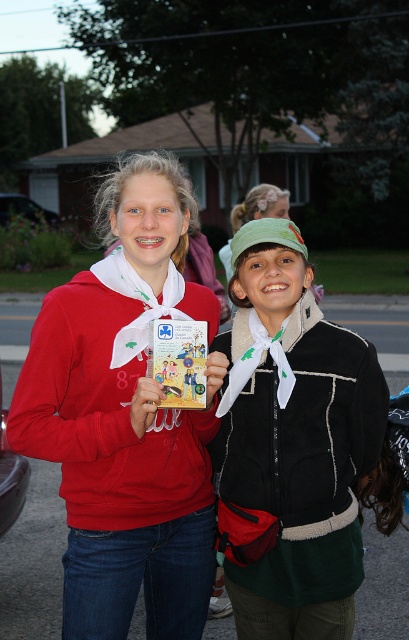
Based on the photo, you are trying to decide whether to pack the black fleece jacket at center or the matte paper comic book at center for your trip. Given their sizes, which item would take up more space in your bag?

The black fleece jacket at center is bigger than the matte paper comic book at center, so it would take up more space in your bag.

You are a photographer trying to capture both the matte red sweatshirt at center and the matte paper comic book at center in a single shot. Since the comic book is behind the sweatshirt, can you adjust your position to ensure both are visible in the photo?

The matte paper comic book at center is behind the matte red sweatshirt at center, so if you move your camera angle slightly to the side or lower your viewpoint, you can position the comic book to be visible around the sweatshirt while still capturing both in the frame.